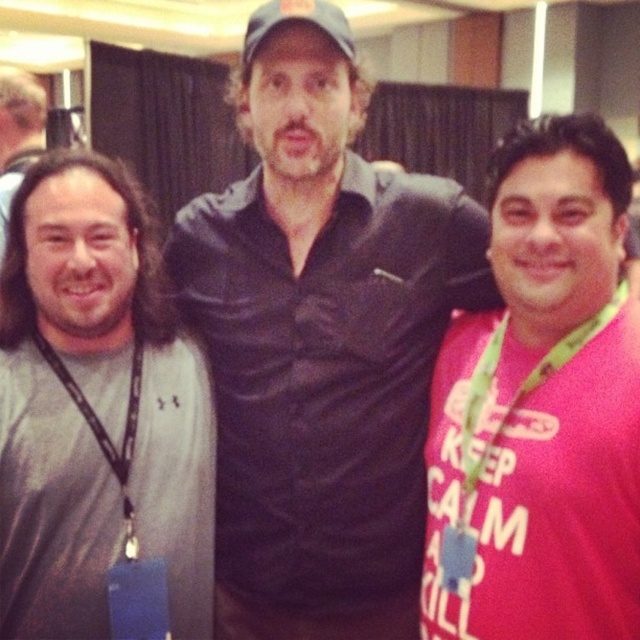
Does green fabric lanyard at right have a lesser width compared to gray fabric baseball cap at center?

No.

Which is behind, point (486, 440) or point (340, 13)?

Positioned behind is point (340, 13).

The width and height of the screenshot is (640, 640). Find the location of `green fabric lanyard at right`. green fabric lanyard at right is located at coordinates (522, 381).

Which of these two, black lanyard at left or gray fabric baseball cap at center, stands taller?

black lanyard at left is taller.

Which is in front, point (51, 352) or point (349, 40)?

Point (51, 352)

You are a GUI agent. You are given a task and a screenshot of the screen. Output one action in this format:
    pyautogui.click(x=<x>, y=<y>)
    Task: Click on the black lanyard at left
    This screenshot has width=640, height=640.
    Given the screenshot: What is the action you would take?
    pyautogui.click(x=106, y=432)

Looking at this image, does green fabric lanyard at right appear on the right side of black lanyard at left?

Indeed, green fabric lanyard at right is positioned on the right side of black lanyard at left.

Between green fabric lanyard at right and black lanyard at left, which one is positioned higher?

green fabric lanyard at right

Which is in front, point (499, 326) or point (42, 337)?

Positioned in front is point (42, 337).

Where is `green fabric lanyard at right`? green fabric lanyard at right is located at coordinates (522, 381).